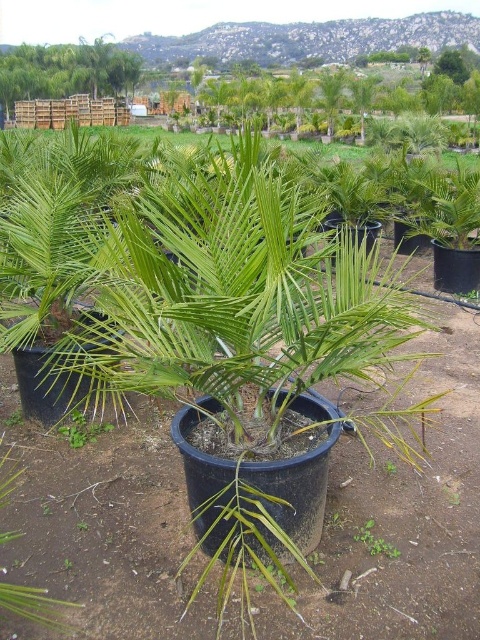
You are a gardener who needs to choose between the green matte palm tree at center and the green leafy plant at upper left for a narrow space. Which plant would be more suitable based on their thickness?

The green matte palm tree at center is thinner than the green leafy plant at upper left, so it would be more suitable for a narrow space.